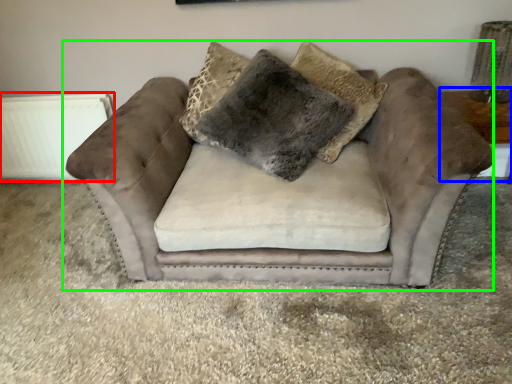
Question: Based on their relative distances, which object is farther from radiator (highlighted by a red box)? Choose from table (highlighted by a blue box) and studio couch (highlighted by a green box).

Choices:
 (A) table
 (B) studio couch

Answer: (A)